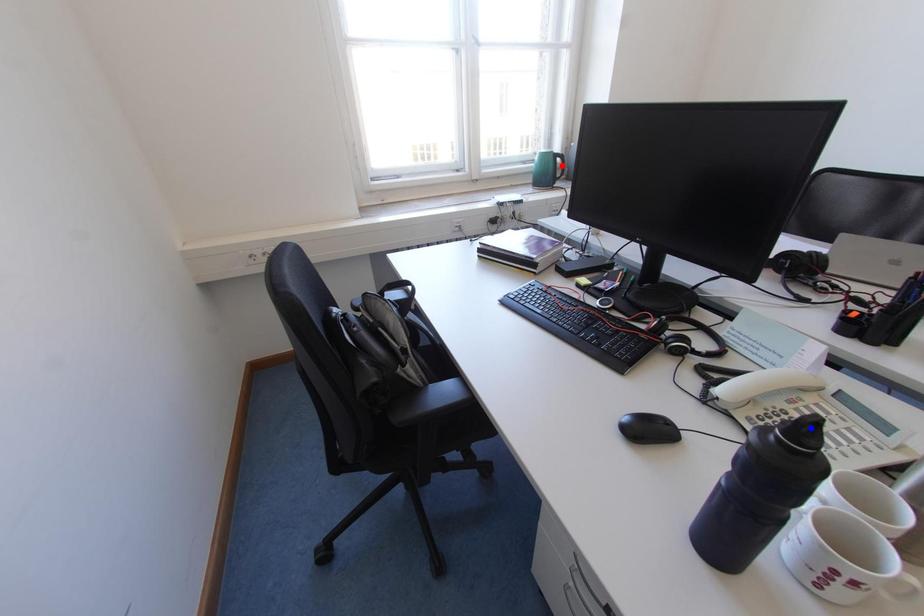
Question: Two points are marked on the image. Which point is closer to the camera?

Choices:
 (A) Blue point is closer.
 (B) Red point is closer.

Answer: (A)